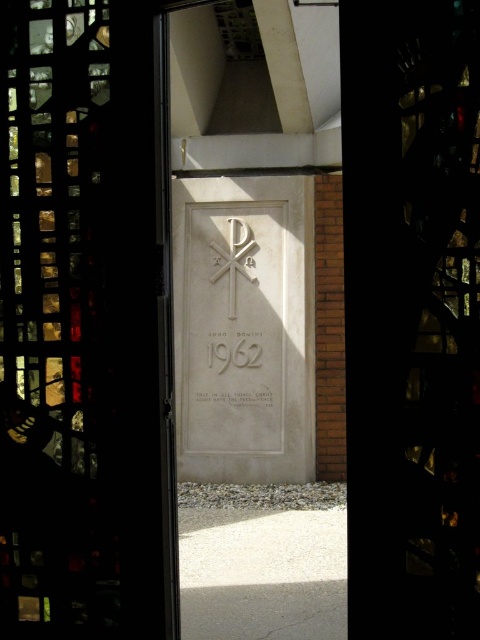
Question: Can you confirm if transparent glass door at center is positioned to the left of transparent stained glass at center?

Choices:
 (A) yes
 (B) no

Answer: (A)

Question: Is white stone plaque at center in front of white stone inscription at center?

Choices:
 (A) yes
 (B) no

Answer: (A)

Question: Which object is farther from the camera taking this photo?

Choices:
 (A) white stone cross at center
 (B) white stone plaque at center
 (C) white stone inscription at center
 (D) white stone writing at center

Answer: (A)

Question: Which point is closer to the camera?

Choices:
 (A) (254, 246)
 (B) (358, 596)
 (C) (242, 356)
 (D) (80, 209)

Answer: (B)

Question: Does transparent glass door at center have a greater width compared to white stone inscription at center?

Choices:
 (A) no
 (B) yes

Answer: (A)

Question: Which point is farther to the camera?

Choices:
 (A) transparent glass door at center
 (B) white stone plaque at center
 (C) white stone cross at center

Answer: (C)